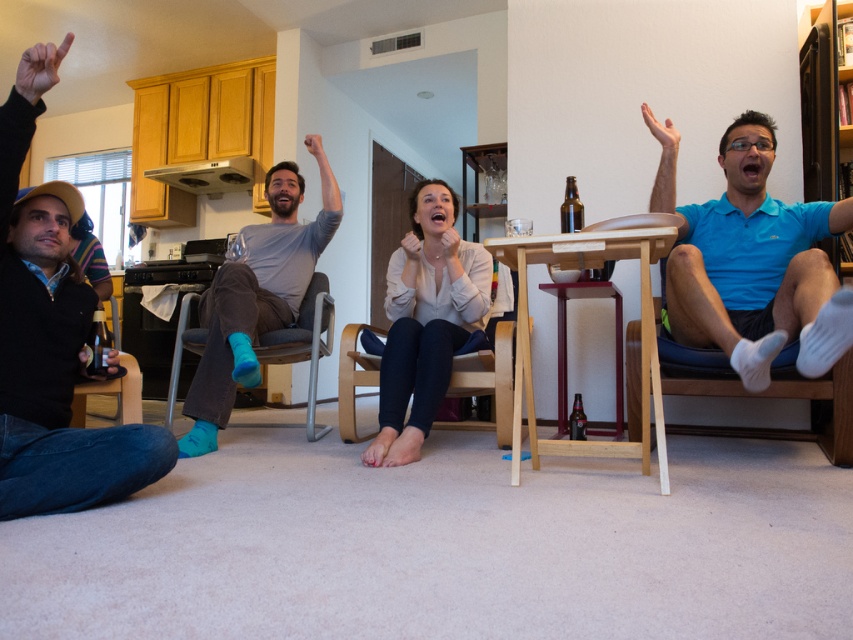
Question: Considering the real-world distances, which object is closest to the matte black hand at upper left?

Choices:
 (A) wooden chair at center
 (B) wooden chair at lower left

Answer: (B)

Question: Does blue fabric chair at right appear over wooden chair at lower left?

Choices:
 (A) no
 (B) yes

Answer: (A)

Question: Which point is farther from the camera taking this photo?

Choices:
 (A) (471, 390)
 (B) (683, 282)

Answer: (A)

Question: Does teal fabric chair at center appear under matte black hand at upper left?

Choices:
 (A) yes
 (B) no

Answer: (A)

Question: Can you confirm if matte black hand at upper left is smaller than matte skin hand at upper right?

Choices:
 (A) yes
 (B) no

Answer: (B)

Question: Based on their relative distances, which object is farther from the matte skin hand at upper right?

Choices:
 (A) blue fabric chair at right
 (B) wooden chair at lower left
 (C) teal fabric chair at center

Answer: (B)